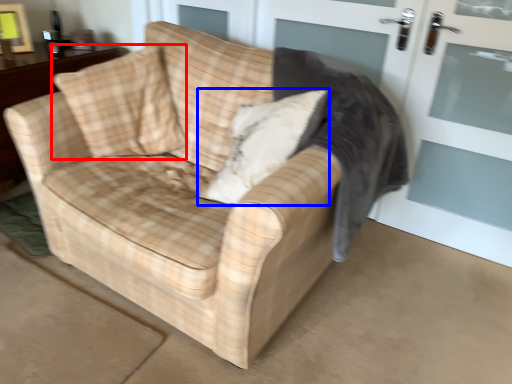
Question: Which object appears farthest to the camera in this image, throw pillow (highlighted by a red box) or throw pillow (highlighted by a blue box)?

Choices:
 (A) throw pillow
 (B) throw pillow

Answer: (A)